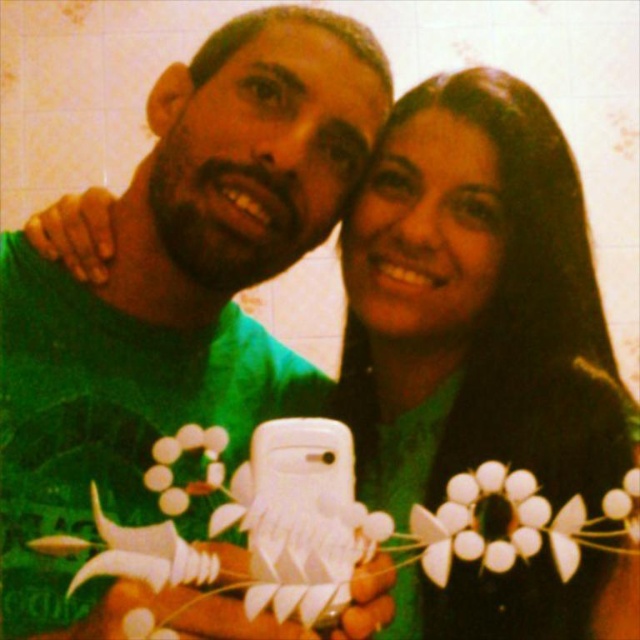
Does green matte necklace at center have a lesser height compared to white paper flower at center?

No, green matte necklace at center is not shorter than white paper flower at center.

Can you confirm if green matte necklace at center is positioned above white paper flower at center?

Yes, green matte necklace at center is above white paper flower at center.

Who is more forward, (467, 218) or (433, 548)?

Point (433, 548) is more forward.

Locate an element on the screen. The image size is (640, 640). green matte necklace at center is located at coordinates (474, 304).

Can you confirm if green matte shirt at center is positioned to the right of green matte necklace at center?

No, green matte shirt at center is not to the right of green matte necklace at center.

Is point (195, 397) positioned behind point (481, 356)?

Yes, it is.

I want to click on green matte shirt at center, so click(x=177, y=289).

Can you confirm if green matte shirt at center is positioned to the left of white paper flower at center?

Correct, you'll find green matte shirt at center to the left of white paper flower at center.

Is green matte shirt at center shorter than white paper flower at center?

In fact, green matte shirt at center may be taller than white paper flower at center.

Between point (218, 132) and point (621, 483), which one is positioned in front?

Point (621, 483) is in front.

Find the location of a particular element. This screenshot has width=640, height=640. green matte shirt at center is located at coordinates (177, 289).